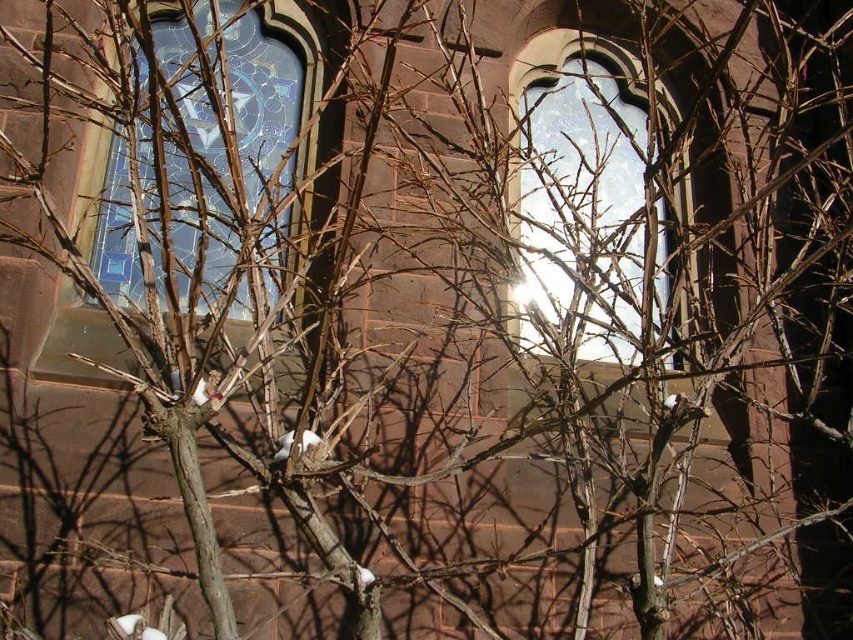
Question: Among these points, which one is farthest from the camera?

Choices:
 (A) (248, 44)
 (B) (576, 349)

Answer: (A)

Question: Does clear glass window at center come behind stained glass window at upper left?

Choices:
 (A) no
 (B) yes

Answer: (A)

Question: Does clear glass window at center appear on the right side of stained glass window at upper left?

Choices:
 (A) yes
 (B) no

Answer: (A)

Question: Does clear glass window at center appear on the right side of stained glass window at upper left?

Choices:
 (A) no
 (B) yes

Answer: (B)

Question: Among these objects, which one is farthest from the camera?

Choices:
 (A) stained glass window at upper left
 (B) clear glass window at center

Answer: (A)

Question: Which point is farther from the camera taking this photo?

Choices:
 (A) (602, 198)
 (B) (270, 282)

Answer: (A)